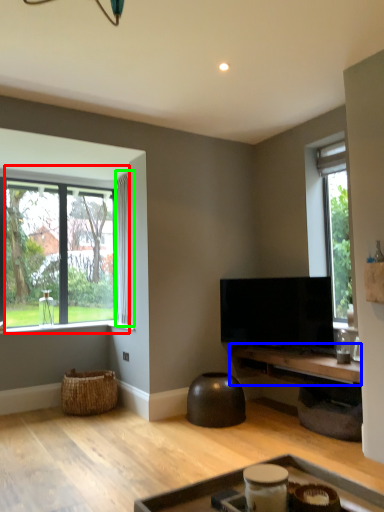
Question: Based on their relative distances, which object is farther from window (highlighted by a red box)? Choose from table (highlighted by a blue box) and curtain (highlighted by a green box).

Choices:
 (A) table
 (B) curtain

Answer: (A)